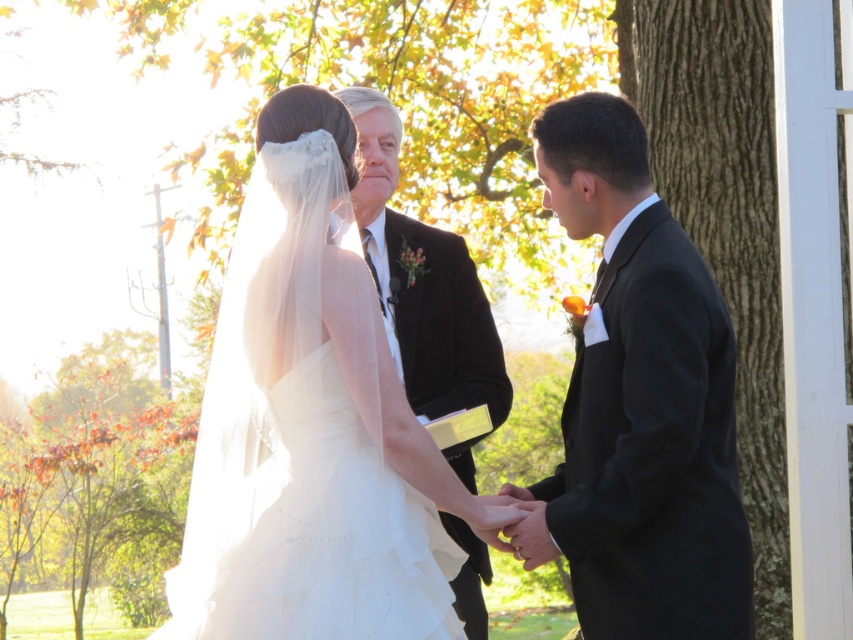
Does matte black suit at right have a lesser width compared to white tulle wedding dress at center?

Indeed, matte black suit at right has a lesser width compared to white tulle wedding dress at center.

Does matte black suit at right lie behind white tulle wedding dress at center?

Yes, matte black suit at right is behind white tulle wedding dress at center.

You are a GUI agent. You are given a task and a screenshot of the screen. Output one action in this format:
    pyautogui.click(x=<x>, y=<y>)
    Task: Click on the matte black suit at right
    
    Given the screenshot: What is the action you would take?
    pyautogui.click(x=637, y=404)

Where is `matte black suit at right`? The height and width of the screenshot is (640, 853). matte black suit at right is located at coordinates (637, 404).

From the picture: Does matte black suit at right have a smaller size compared to reddish-brown leaves at left?

Yes.

Image resolution: width=853 pixels, height=640 pixels. What do you see at coordinates (637, 404) in the screenshot? I see `matte black suit at right` at bounding box center [637, 404].

The height and width of the screenshot is (640, 853). Identify the location of matte black suit at right. (637, 404).

The image size is (853, 640). What are the coordinates of `white tulle wedding dress at center` in the screenshot? It's located at (312, 532).

Between point (366, 496) and point (109, 566), which one is positioned in front?

Point (366, 496) is in front.

The width and height of the screenshot is (853, 640). I want to click on white tulle wedding dress at center, so click(312, 532).